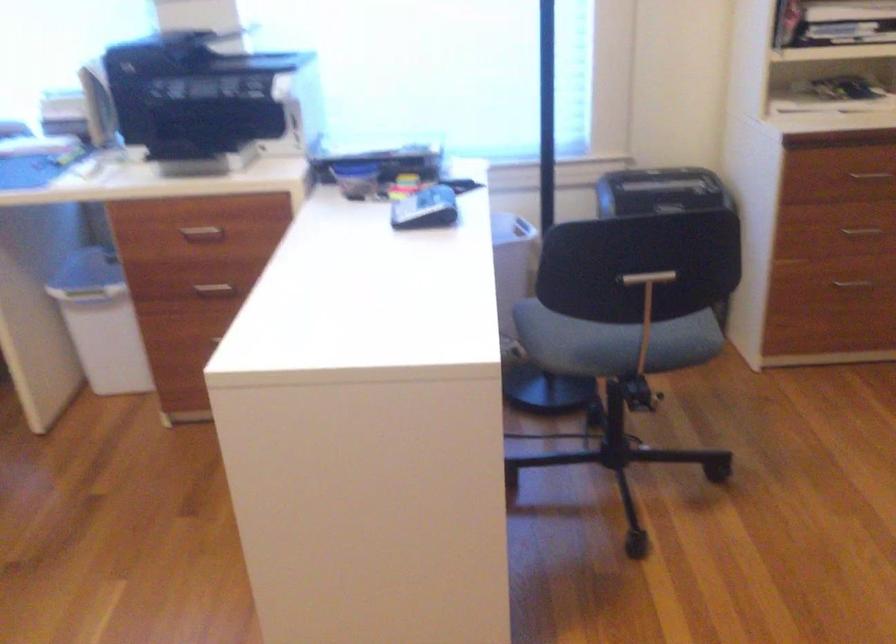
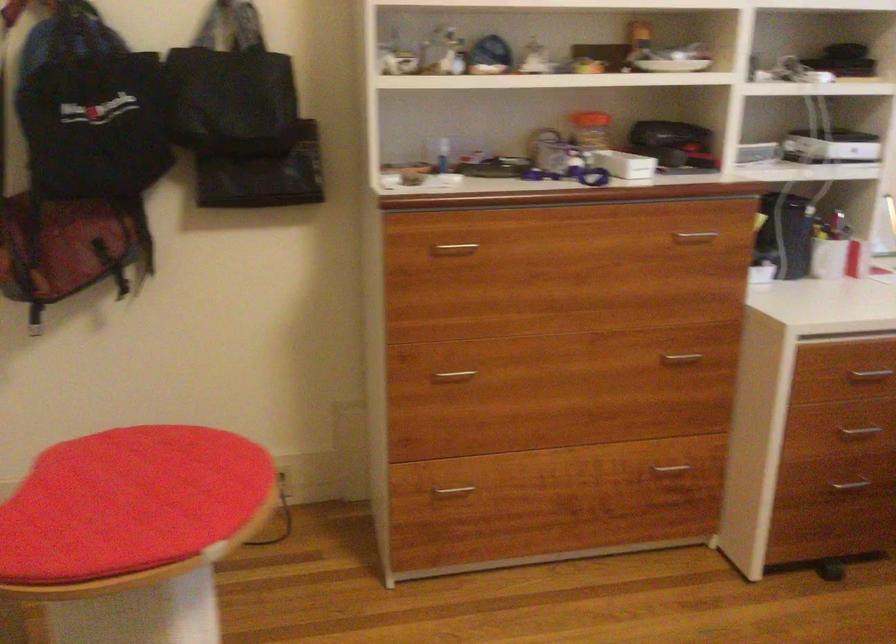
Question: The first image is from the beginning of the video and the second image is from the end. How did the camera likely rotate when shooting the video?

Choices:
 (A) Left
 (B) Right
 (C) Up
 (D) Down

Answer: (A)